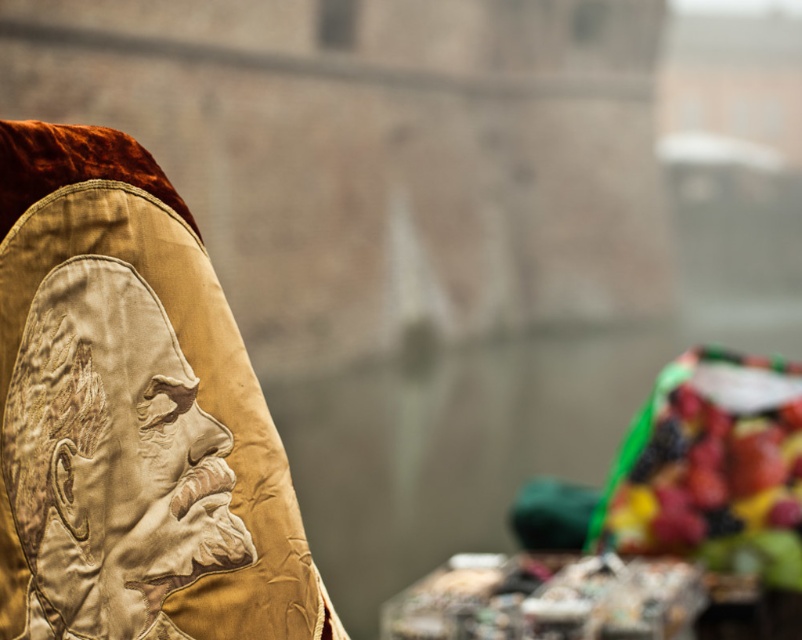
Question: Which object is farther from the camera taking this photo?

Choices:
 (A) satin gold portrait at left
 (B) shiny plastic fruits at right

Answer: (B)

Question: Can you confirm if satin gold portrait at left is wider than shiny plastic fruits at right?

Choices:
 (A) no
 (B) yes

Answer: (A)

Question: Which point is farther from the camera taking this photo?

Choices:
 (A) (18, 435)
 (B) (758, 492)

Answer: (B)

Question: Is satin gold portrait at left positioned in front of shiny plastic fruits at right?

Choices:
 (A) no
 (B) yes

Answer: (B)

Question: Which point is closer to the camera?

Choices:
 (A) satin gold portrait at left
 (B) shiny plastic fruits at right

Answer: (A)

Question: Does satin gold portrait at left have a lesser width compared to shiny plastic fruits at right?

Choices:
 (A) no
 (B) yes

Answer: (B)